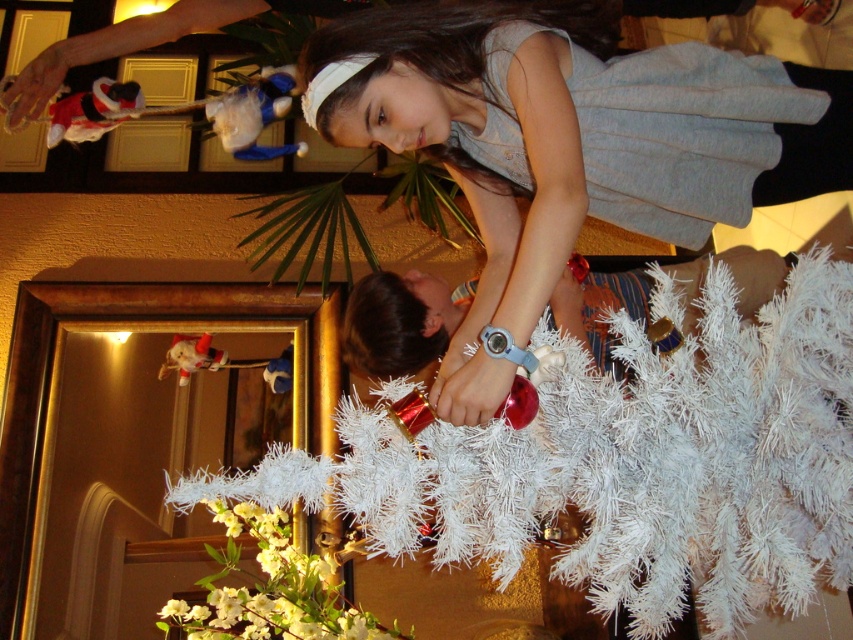
You are a photographer standing in the room and want to capture a photo that includes both the matte gray dress at upper center and the matte red santa at lower left. Given that your camera has a maximum focus range of 2 meters, will you be able to get both subjects in focus at the same time?

The distance between the matte gray dress at upper center and the matte red santa at lower left is 2.09 meters. Since the camera can only focus within 2 meters, the subjects are slightly out of the focus range. You might need to adjust your position or use a different camera setting to ensure both are in focus.

You are a photographer setting up for a family photo. You see the matte gray dress at upper center and the matte red santa at lower left in the scene. Which object should you focus on first if you want to capture the larger one?

The matte gray dress at upper center has a larger size compared to the matte red santa at lower left, so you should focus on the matte gray dress at upper center first.

From the picture: You are standing in front of the white artificial tree at center and want to take a photo of it with your phone. Your phone has a minimum focus distance of 1 meter. Will the tree be in focus?

The white artificial tree at center is 1.21 meters away from the camera, which is beyond the phone camera minimum focus distance of 1 meter. Therefore, the tree will be in focus.